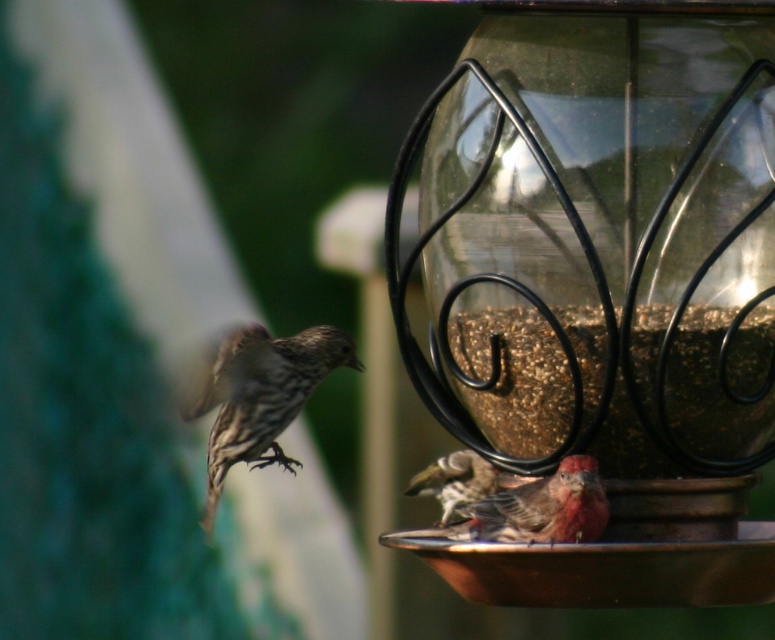
You are a bird with a wingspan of 20 cm. You want to land on the translucent glass bird feeder at center. Can you fit comfortably on it without overlapping the brown speckled feathers at lower center?

The translucent glass bird feeder at center is wider than the brown speckled feathers at lower center. Since your wingspan is 20 cm, you should be able to land comfortably on the feeder without overlapping the brown speckled feathers at lower center, as the feeder is wider than the feathers.

In the scene shown: You are standing in front of the bird feeder and see two points marked on the feeder. Which point is closer to you, point (636,456) or point (470,452)?

Point (636,456) is in front of point (470,452), so it is closer to you.

Looking at this image, you are a small bird with a preference for seeds. You see the brown textured seeds at center and the rusty brown feathers at lower center. Which one is located to the right of the other?

The brown textured seeds at center are to the right of the rusty brown feathers at lower center.